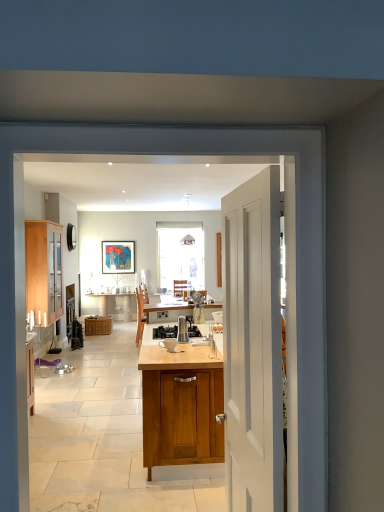
Question: Should I look upward or downward to see woven brown picnic basket at center?

Choices:
 (A) down
 (B) up

Answer: (A)

Question: From the image's perspective, is stainless steel gas stove at center beneath metallic pendant light at upper center?

Choices:
 (A) no
 (B) yes

Answer: (B)

Question: Considering the relative sizes of stainless steel gas stove at center and metallic pendant light at upper center in the image provided, is stainless steel gas stove at center thinner than metallic pendant light at upper center?

Choices:
 (A) yes
 (B) no

Answer: (B)

Question: Could you tell me if stainless steel gas stove at center is turned towards metallic pendant light at upper center?

Choices:
 (A) no
 (B) yes

Answer: (A)

Question: Considering the relative sizes of stainless steel gas stove at center and metallic pendant light at upper center in the image provided, is stainless steel gas stove at center bigger than metallic pendant light at upper center?

Choices:
 (A) no
 (B) yes

Answer: (A)

Question: Does stainless steel gas stove at center come in front of metallic pendant light at upper center?

Choices:
 (A) yes
 (B) no

Answer: (A)

Question: Can you confirm if stainless steel gas stove at center is taller than metallic pendant light at upper center?

Choices:
 (A) no
 (B) yes

Answer: (A)

Question: Is wooden cabinet at center at the right side of metallic pendant light at upper center?

Choices:
 (A) no
 (B) yes

Answer: (A)

Question: From a real-world perspective, does wooden cabinet at center stand above metallic pendant light at upper center?

Choices:
 (A) yes
 (B) no

Answer: (B)

Question: Considering the relative sizes of wooden cabinet at center and metallic pendant light at upper center in the image provided, is wooden cabinet at center thinner than metallic pendant light at upper center?

Choices:
 (A) no
 (B) yes

Answer: (B)

Question: From the image's perspective, is wooden cabinet at center beneath metallic pendant light at upper center?

Choices:
 (A) yes
 (B) no

Answer: (A)

Question: From a real-world perspective, is wooden cabinet at center under metallic pendant light at upper center?

Choices:
 (A) no
 (B) yes

Answer: (B)

Question: Is wooden cabinet at center taller than metallic pendant light at upper center?

Choices:
 (A) yes
 (B) no

Answer: (A)

Question: Is wooden cabinet at center located outside light wood/glass cabinet at left?

Choices:
 (A) no
 (B) yes

Answer: (B)